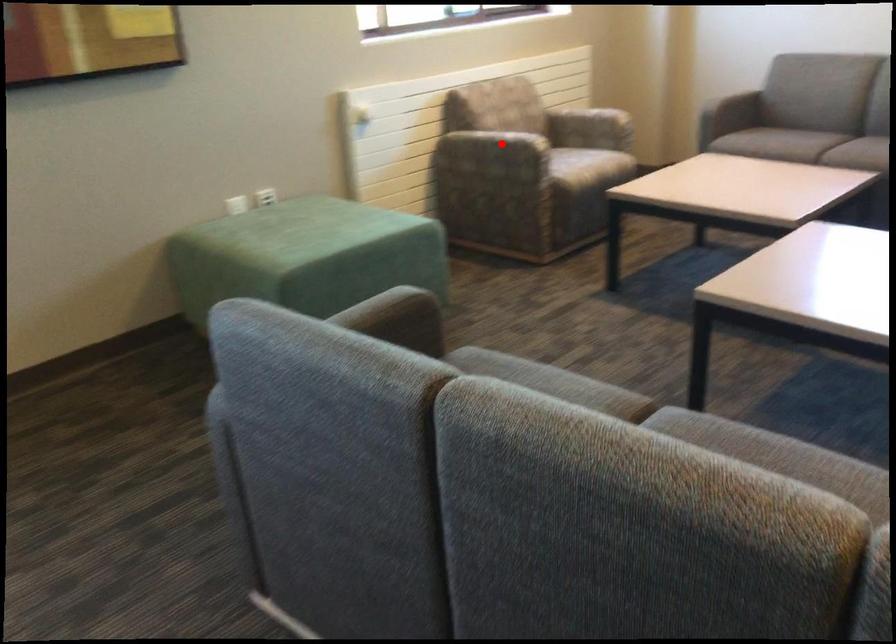
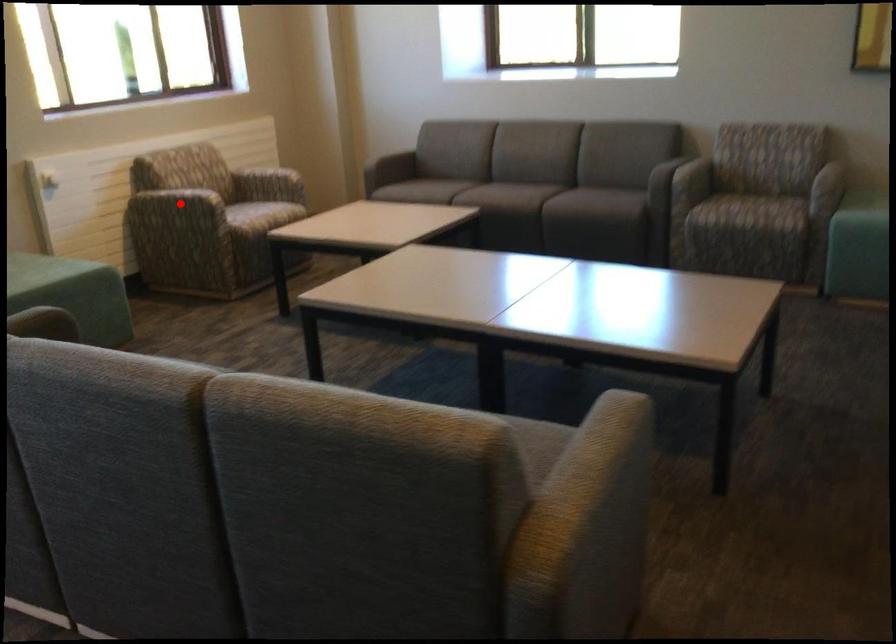
I am providing you with two images of the same scene from different viewpoints. A red point is marked on the first image and another point is marked on the second image. Are the points marked in image1 and image2 representing the same 3D position?

Yes